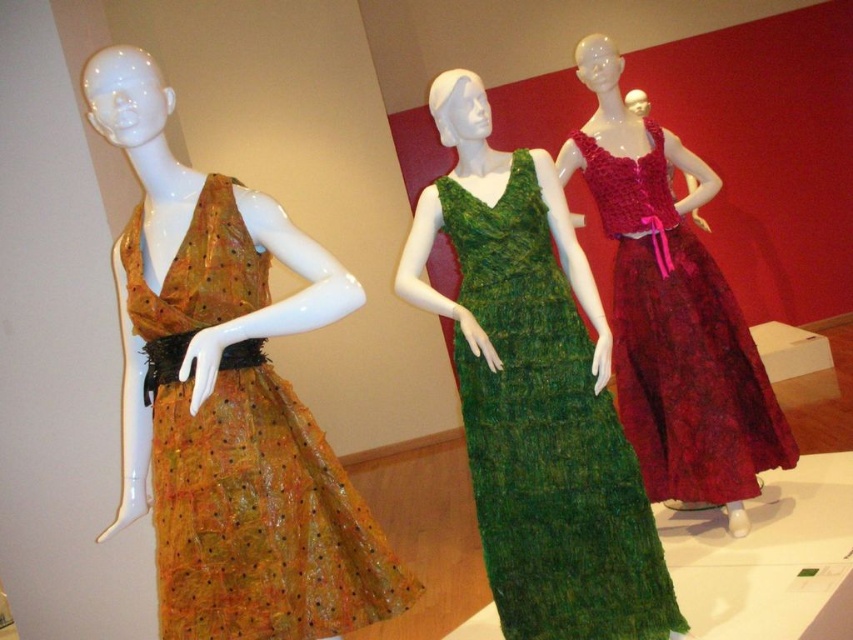
You are standing in front of the three mannequins and want to touch the translucent orange dress at left and the green knitted dress at center. Which dress will your hand reach first?

The translucent orange dress at left is closer to the viewer than the green knitted dress at center, so you will reach the translucent orange dress at left first.

You are a fashion designer who wants to place a 24 inch wide mannequin between the translucent orange dress at left and the green knitted dress at center. Will there be enough space?

The distance between the translucent orange dress at left and the green knitted dress at center is 25.34 inches, so placing a 24 inch wide mannequin between them would leave 1.34 inches of space on each side. This is a tight fit but technically possible.